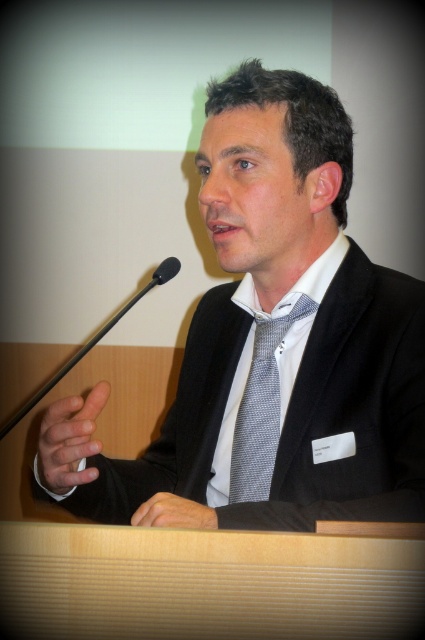
Question: Does black textured suit at center come in front of black plastic microphone at left?

Choices:
 (A) no
 (B) yes

Answer: (B)

Question: Which object is closer to the camera taking this photo?

Choices:
 (A) gray dotted tie at center
 (B) white textured dress shirt at center

Answer: (A)

Question: Which point is farther from the camera taking this photo?

Choices:
 (A) (22, 406)
 (B) (274, 449)

Answer: (A)

Question: Is black textured suit at center further to camera compared to gray dotted tie at center?

Choices:
 (A) no
 (B) yes

Answer: (A)

Question: Is white textured dress shirt at center positioned at the back of black plastic microphone at left?

Choices:
 (A) yes
 (B) no

Answer: (A)

Question: Which of the following is the closest to the observer?

Choices:
 (A) (175, 266)
 (B) (238, 189)

Answer: (B)